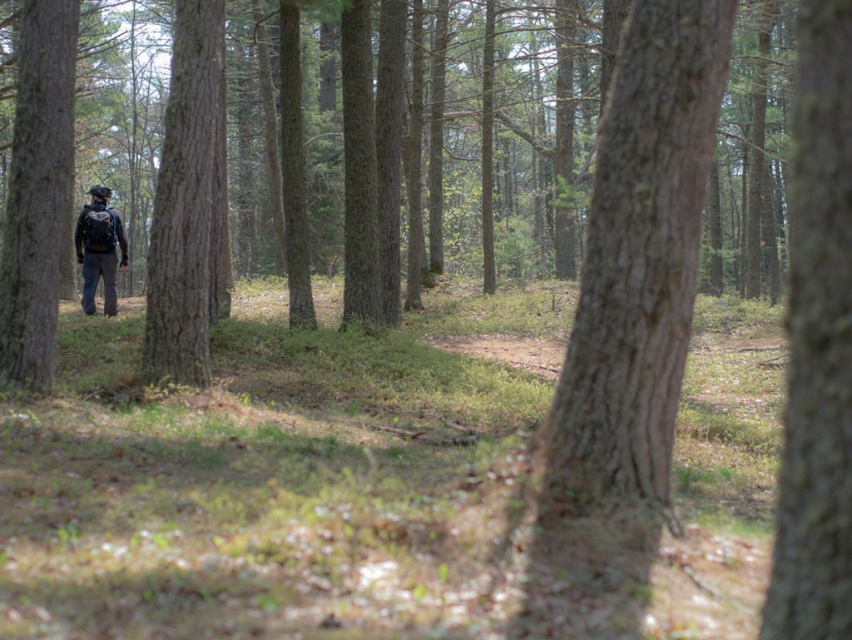
You are standing on the dirt path in the forest and see the smooth brown bark at center. Can you determine its exact location using the coordinate system provided?

The smooth brown bark at center is located at point (628, 326).